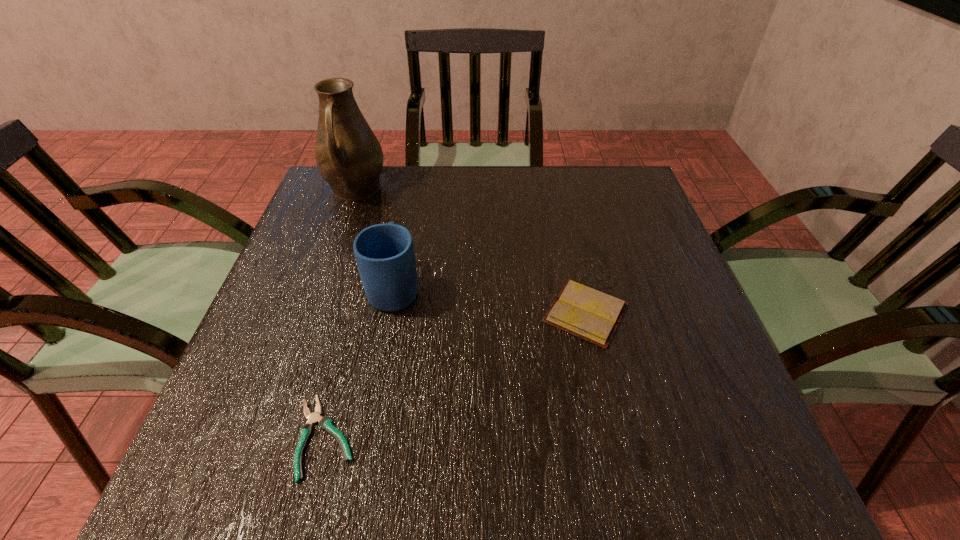
This screenshot has width=960, height=540. I want to click on free spot located 0.310m on the side of the third shortest object with the handle, so click(x=414, y=186).

Locate an element on the screen. This screenshot has height=540, width=960. vacant space located on the left of the rightmost object is located at coordinates (438, 313).

The height and width of the screenshot is (540, 960). I want to click on vacant space located on the right of the nearest object, so click(395, 437).

Find the location of a particular element. The height and width of the screenshot is (540, 960). object that is positioned at the far edge is located at coordinates (349, 157).

At what (x,y) coordinates should I click in order to perform the action: click on object located in the near edge section of the desktop. Please return your answer as a coordinate pair (x, y). Looking at the image, I should click on tap(325, 423).

The width and height of the screenshot is (960, 540). In order to click on pitcher present at the left edge in this screenshot , I will do `click(349, 157)`.

You are a GUI agent. You are given a task and a screenshot of the screen. Output one action in this format:
    pyautogui.click(x=<x>, y=<y>)
    Task: Click on the pliers that is at the left edge
    The width and height of the screenshot is (960, 540).
    Given the screenshot: What is the action you would take?
    pyautogui.click(x=325, y=423)

Find the location of a particular element. object at the right edge is located at coordinates (582, 311).

You are a GUI agent. You are given a task and a screenshot of the screen. Output one action in this format:
    pyautogui.click(x=<x>, y=<y>)
    Task: Click on the object at the far left corner
    The height and width of the screenshot is (540, 960).
    Given the screenshot: What is the action you would take?
    pyautogui.click(x=349, y=157)

In order to click on object located in the near left corner section of the desktop in this screenshot , I will do `click(325, 423)`.